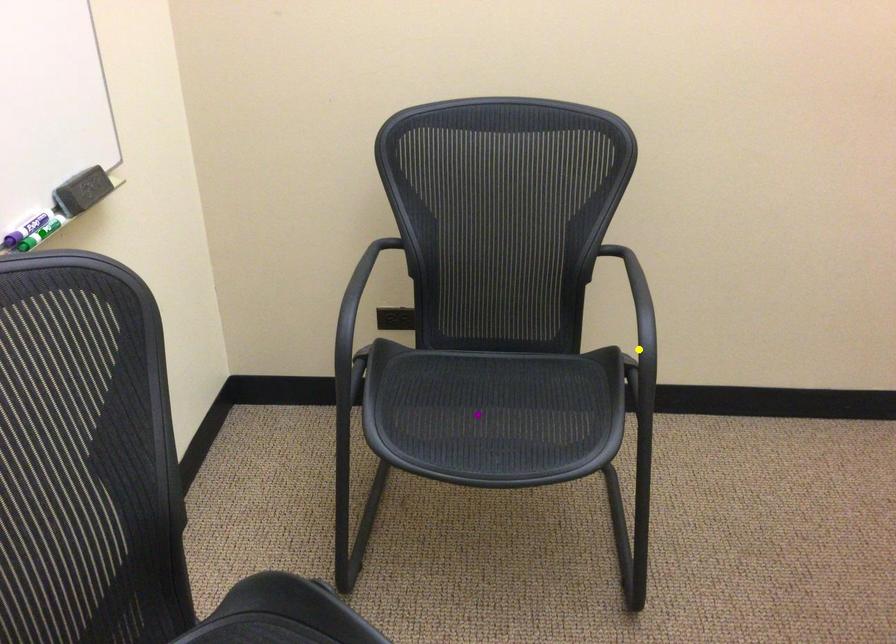
Order these from nearest to farthest:
A) yellow point
B) green point
C) purple point

yellow point, purple point, green point